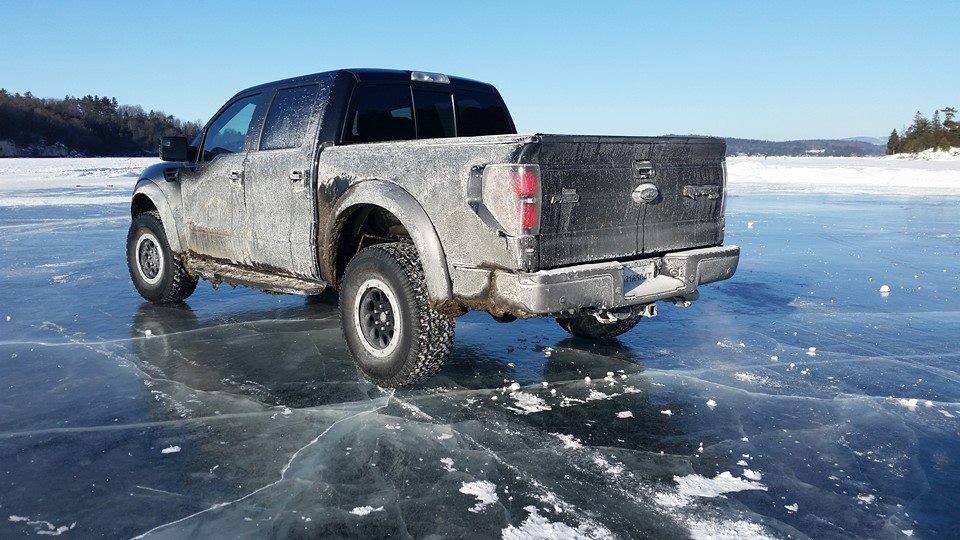
The height and width of the screenshot is (540, 960). In order to click on windows in this screenshot , I will do pos(236,132), pos(285,124), pos(389,107), pos(440,111), pos(462,107).